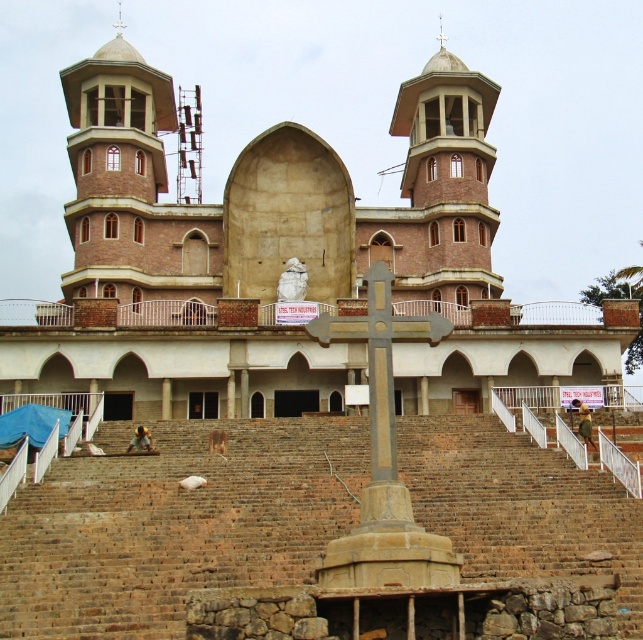
Question: Among these objects, which one is nearest to the camera?

Choices:
 (A) brick tower at center
 (B) brown brick stairs at center
 (C) brown brick tower at upper left

Answer: (B)

Question: Is brown brick tower at upper left behind brick tower at center?

Choices:
 (A) no
 (B) yes

Answer: (A)

Question: Is brown brick stairs at center to the left of brick tower at center from the viewer's perspective?

Choices:
 (A) no
 (B) yes

Answer: (B)

Question: Is brown brick stairs at center to the left of brick tower at center from the viewer's perspective?

Choices:
 (A) no
 (B) yes

Answer: (B)

Question: Estimate the real-world distances between objects in this image. Which object is closer to the brick tower at center?

Choices:
 (A) brown brick stairs at center
 (B) brown brick tower at upper left

Answer: (B)

Question: Which object is farther from the camera taking this photo?

Choices:
 (A) brown brick tower at upper left
 (B) brick tower at center

Answer: (B)